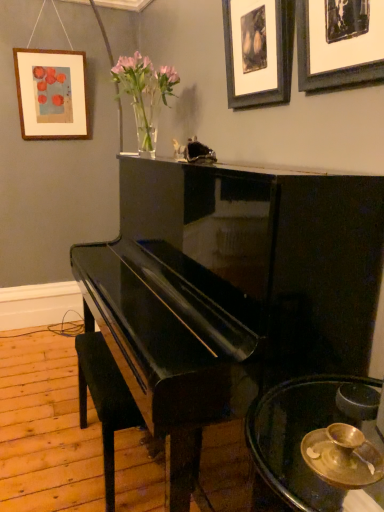
Where is `blank space situated above wooden picture frame at upper left, the third picture frame in the right-to-left sequence (from a real-world perspective)`? blank space situated above wooden picture frame at upper left, the third picture frame in the right-to-left sequence (from a real-world perspective) is located at coordinates point(49,51).